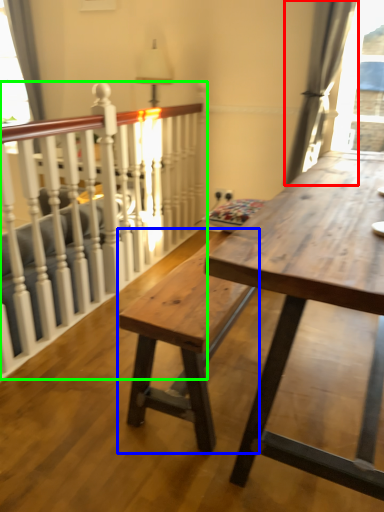
Question: Considering the real-world distances, which object is closest to curtain (highlighted by a red box)? bench (highlighted by a blue box) or rail (highlighted by a green box).

Choices:
 (A) bench
 (B) rail

Answer: (B)